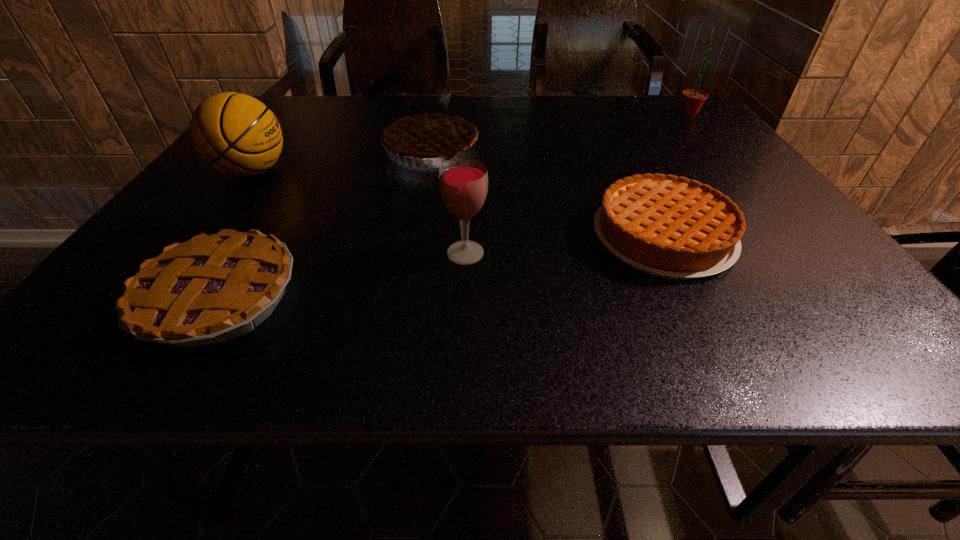
Identify the location of pie positioned at the left edge. The height and width of the screenshot is (540, 960). (213, 288).

At what (x,y) coordinates should I click in order to perform the action: click on sunflower that is at the right edge. Please return your answer as a coordinate pair (x, y). Looking at the image, I should click on (692, 100).

This screenshot has width=960, height=540. Identify the location of pie that is at the right edge. (668, 226).

In order to click on object that is at the near left corner in this screenshot , I will do `click(213, 288)`.

Locate an element on the screen. Image resolution: width=960 pixels, height=540 pixels. object positioned at the far right corner is located at coordinates (692, 100).

In order to click on vacant region at the far edge of the desktop in this screenshot , I will do `click(330, 119)`.

Find the location of `vacant space at the near edge`. vacant space at the near edge is located at coordinates (680, 349).

At what (x,y) coordinates should I click in order to perform the action: click on free space at the left edge. Please return your answer as a coordinate pair (x, y). The image size is (960, 540). Looking at the image, I should click on (112, 308).

Where is `vacant area at the right edge of the desktop`? vacant area at the right edge of the desktop is located at coordinates [780, 244].

Find the location of a particular element. This screenshot has width=960, height=540. free space at the far left corner of the desktop is located at coordinates (298, 117).